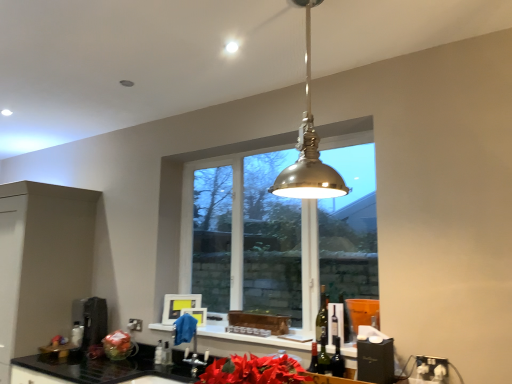
What do you see at coordinates (103, 367) in the screenshot? The width and height of the screenshot is (512, 384). I see `black granite countertop at lower left` at bounding box center [103, 367].

Where is `translucent glass wine bottle at center`? The height and width of the screenshot is (384, 512). translucent glass wine bottle at center is located at coordinates (322, 316).

What do you see at coordinates (167, 354) in the screenshot? The height and width of the screenshot is (384, 512). I see `clear glass bottle at lower center, which is the 1th bottle from right to left` at bounding box center [167, 354].

You are a GUI agent. You are given a task and a screenshot of the screen. Output one action in this format:
    pyautogui.click(x=<x>, y=<y>)
    Task: Click on the green glass bottle at center
    This screenshot has width=512, height=384.
    Given the screenshot: What is the action you would take?
    pyautogui.click(x=337, y=359)

What is the approximate width of polished brass pendant light at center?

It is 38.13 centimeters.

What are the coordinates of `polished brass pendant light at center` in the screenshot? It's located at (308, 146).

The width and height of the screenshot is (512, 384). I want to click on white glossy window sill at center, so click(x=250, y=337).

Image resolution: width=512 pixels, height=384 pixels. I want to click on matte black cabinet at left, so click(x=42, y=263).

What do you see at coordinates (42, 263) in the screenshot? I see `matte black cabinet at left` at bounding box center [42, 263].

Identify the location of clear glass window at center. The width and height of the screenshot is (512, 384). (278, 228).

You are a GUI agent. You are given a task and a screenshot of the screen. Output one action in this format:
    pyautogui.click(x=<x>, y=<y>)
    Task: Click on the black granite countertop at lower left
    This screenshot has width=512, height=384.
    Given the screenshot: What is the action you would take?
    pyautogui.click(x=103, y=367)

Is polished brass pendant light at center turned away from clear glass window at center?

polished brass pendant light at center does not have its back to clear glass window at center.

Which object is thinner, polished brass pendant light at center or clear glass window at center?

Thinner between the two is clear glass window at center.

Is point (310, 85) positioned behind point (199, 257)?

No, (310, 85) is in front of (199, 257).

In the image, is polished brass pendant light at center on the left side or the right side of clear glass window at center?

polished brass pendant light at center is positioned on clear glass window at center's right side.

There is a clear glass bottle at lower center, which ranks as the 1th bottle in left-to-right order. Identify the location of window above it (from a real-world perspective). (278, 228).

Is clear glass window at center oriented away from clear glass bottle at lower center, marked as the second bottle in a right-to-left arrangement?

No, clear glass window at center is not facing the opposite direction of clear glass bottle at lower center, marked as the second bottle in a right-to-left arrangement.

Does point (334, 153) come farther from viewer compared to point (158, 358)?

That is True.

Does clear glass window at center have a lesser height compared to clear glass bottle at lower center, marked as the second bottle in a right-to-left arrangement?

Incorrect, the height of clear glass window at center does not fall short of that of clear glass bottle at lower center, marked as the second bottle in a right-to-left arrangement.

Looking at this image, would you say translucent glass wine bottle at center is a long distance from clear glass bottle at lower center, which is counted as the 2th bottle, starting from the left?

Indeed, translucent glass wine bottle at center is not near clear glass bottle at lower center, which is counted as the 2th bottle, starting from the left.

Is clear glass bottle at lower center, which is the 1th bottle from right to left, located within translucent glass wine bottle at center?

Definitely not — clear glass bottle at lower center, which is the 1th bottle from right to left, is not inside translucent glass wine bottle at center.

Consider the image. From a real-world perspective, which object rests below the other?

clear glass bottle at lower center, which is the 1th bottle from right to left, is physically lower.

Does point (319, 311) appear closer or farther from the camera than point (167, 358)?

Point (319, 311).

From the image's perspective, which object appears higher, metallic stainless steel coffee machine at lower left or clear glass window at center?

clear glass window at center, from the image's perspective.

Between metallic stainless steel coffee machine at lower left and clear glass window at center, which one has smaller size?

metallic stainless steel coffee machine at lower left is smaller.

Which is correct: metallic stainless steel coffee machine at lower left is inside clear glass window at center, or outside of it?

metallic stainless steel coffee machine at lower left is not enclosed by clear glass window at center.

This screenshot has width=512, height=384. In order to click on window above the metallic stainless steel coffee machine at lower left (from the image's perspective) in this screenshot , I will do `click(278, 228)`.

Is metallic stainless steel coffee machine at lower left positioned before white glossy window sill at center?

No, metallic stainless steel coffee machine at lower left is further to the viewer.

Which point is more forward, (98, 330) or (161, 328)?

The point (161, 328) is closer.

Is metallic stainless steel coffee machine at lower left completely or partially outside of white glossy window sill at center?

metallic stainless steel coffee machine at lower left lies outside white glossy window sill at center's area.

Is black granite countertop at lower left not close to clear glass bottle at lower center, which ranks as the 1th bottle in left-to-right order?

No, black granite countertop at lower left is in close proximity to clear glass bottle at lower center, which ranks as the 1th bottle in left-to-right order.

Considering the sizes of black granite countertop at lower left and clear glass bottle at lower center, marked as the second bottle in a right-to-left arrangement, in the image, is black granite countertop at lower left bigger or smaller than clear glass bottle at lower center, marked as the second bottle in a right-to-left arrangement,?

black granite countertop at lower left is bigger than clear glass bottle at lower center, marked as the second bottle in a right-to-left arrangement.

Does black granite countertop at lower left turn towards clear glass bottle at lower center, marked as the second bottle in a right-to-left arrangement?

No, black granite countertop at lower left is not facing towards clear glass bottle at lower center, marked as the second bottle in a right-to-left arrangement.

Is black granite countertop at lower left shorter than clear glass bottle at lower center, which ranks as the 1th bottle in left-to-right order?

Incorrect, the height of black granite countertop at lower left does not fall short of that of clear glass bottle at lower center, which ranks as the 1th bottle in left-to-right order.

In the image, there is a black granite countertop at lower left. Identify the location of appliance above it (from the image's perspective). (91, 320).

Is the position of black granite countertop at lower left more distant than that of metallic stainless steel coffee machine at lower left?

That is False.

Is there a large distance between black granite countertop at lower left and metallic stainless steel coffee machine at lower left?

black granite countertop at lower left is near metallic stainless steel coffee machine at lower left, not far away.

Is black granite countertop at lower left facing towards metallic stainless steel coffee machine at lower left?

No, black granite countertop at lower left is not aimed at metallic stainless steel coffee machine at lower left.

The width and height of the screenshot is (512, 384). Find the location of `window that is below the polished brass pendant light at center (from the image's perspective)`. window that is below the polished brass pendant light at center (from the image's perspective) is located at coordinates (278, 228).

Find the location of a particular element. the 1st bottle located beneath the clear glass window at center (from a real-world perspective) is located at coordinates (158, 353).

Consider the image. When comparing their distances from clear glass window at center, does translucent glass wine bottle at center or clear glass bottle at lower center, which is counted as the 2th bottle, starting from the left, seem closer?

Among the two, translucent glass wine bottle at center is located nearer to clear glass window at center.

When comparing their distances from black granite countertop at lower left, does matte black cabinet at left or translucent glass wine bottle at center seem further?

translucent glass wine bottle at center is further to black granite countertop at lower left.

When comparing their distances from metallic stainless steel coffee machine at lower left, does translucent glass wine bottle at center or green glass bottle at center seem closer?

translucent glass wine bottle at center is closer to metallic stainless steel coffee machine at lower left.

Considering their positions, is translucent glass wine bottle at center positioned closer to clear glass bottle at lower center, marked as the second bottle in a right-to-left arrangement, than clear glass bottle at lower center, which is the 1th bottle from right to left?

Based on the image, clear glass bottle at lower center, which is the 1th bottle from right to left, appears to be nearer to clear glass bottle at lower center, marked as the second bottle in a right-to-left arrangement.

Considering their positions, is clear glass window at center positioned closer to clear glass bottle at lower center, which ranks as the 1th bottle in left-to-right order, than metallic stainless steel coffee machine at lower left?

Based on the image, metallic stainless steel coffee machine at lower left appears to be nearer to clear glass bottle at lower center, which ranks as the 1th bottle in left-to-right order.

From the image, which object appears to be farther from clear glass bottle at lower center, which ranks as the 1th bottle in left-to-right order, metallic stainless steel coffee machine at lower left or clear glass window at center?

clear glass window at center.

Looking at this image, considering their positions, is clear glass window at center positioned closer to clear glass bottle at lower center, which is counted as the 2th bottle, starting from the left, than green glass bottle at center?

green glass bottle at center is closer to clear glass bottle at lower center, which is counted as the 2th bottle, starting from the left.

Considering their positions, is matte black cabinet at left positioned further to clear glass window at center than clear glass bottle at lower center, marked as the second bottle in a right-to-left arrangement?

Among the two, clear glass bottle at lower center, marked as the second bottle in a right-to-left arrangement, is located further to clear glass window at center.

Identify the location of light located between metallic stainless steel coffee machine at lower left and green glass bottle at center in the left-right direction. Image resolution: width=512 pixels, height=384 pixels. (308, 146).

Identify the location of countertop located between metallic stainless steel coffee machine at lower left and white glossy window sill at center in the left-right direction. The width and height of the screenshot is (512, 384). (103, 367).

The height and width of the screenshot is (384, 512). Identify the location of window sill located between metallic stainless steel coffee machine at lower left and green glass bottle at center in the left-right direction. (250, 337).

I want to click on window sill between clear glass bottle at lower center, marked as the second bottle in a right-to-left arrangement, and green glass bottle at center, so click(x=250, y=337).